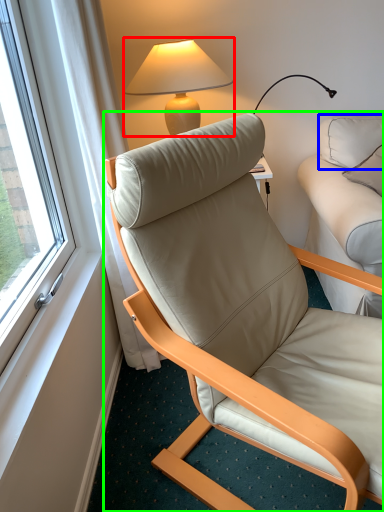
Question: Considering the real-world distances, which object is closest to lamp (highlighted by a red box)? pillow (highlighted by a blue box) or chair (highlighted by a green box).

Choices:
 (A) pillow
 (B) chair

Answer: (A)